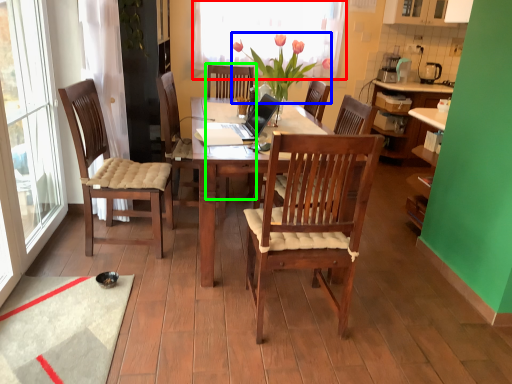
Question: Considering the real-world distances, which object is closest to window screen (highlighted by a red box)? flower (highlighted by a blue box) or armchair (highlighted by a green box).

Choices:
 (A) flower
 (B) armchair

Answer: (B)